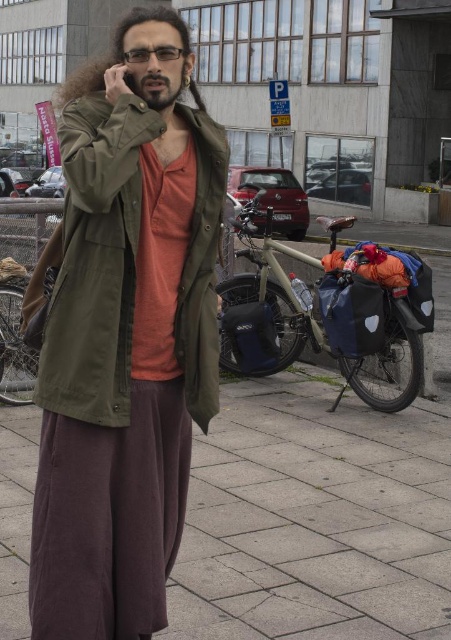
Question: Does gray concrete pavement at center lie behind olive green fabric jacket at center?

Choices:
 (A) no
 (B) yes

Answer: (B)

Question: Does gray concrete pavement at center have a greater width compared to olive green fabric jacket at center?

Choices:
 (A) yes
 (B) no

Answer: (A)

Question: Which object appears farthest from the camera in this image?

Choices:
 (A) gray concrete pavement at center
 (B) olive green fabric jacket at center

Answer: (A)

Question: Among these points, which one is farthest from the camera?

Choices:
 (A) (189, 332)
 (B) (396, 563)

Answer: (B)

Question: From the image, what is the correct spatial relationship of gray concrete pavement at center in relation to olive green fabric jacket at center?

Choices:
 (A) right
 (B) left

Answer: (A)